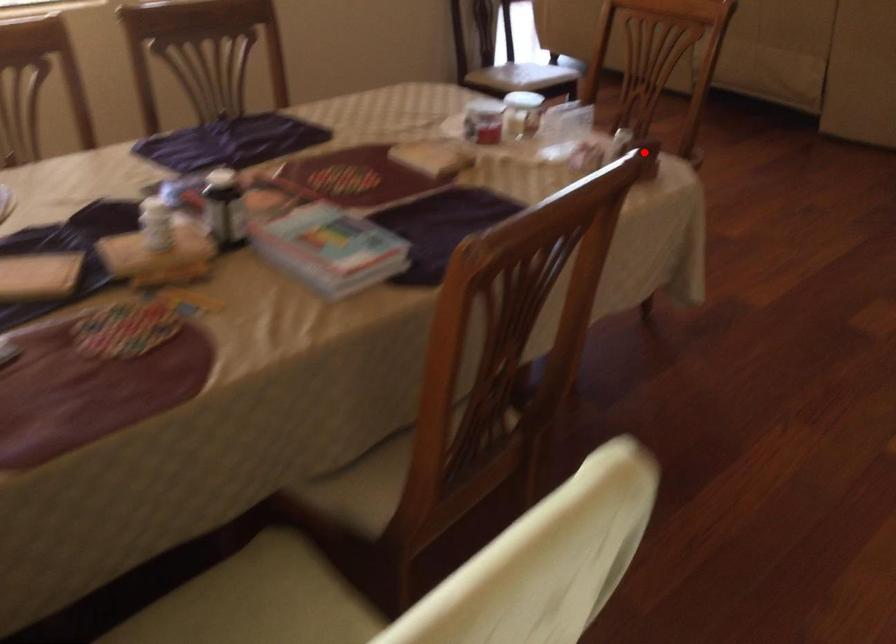
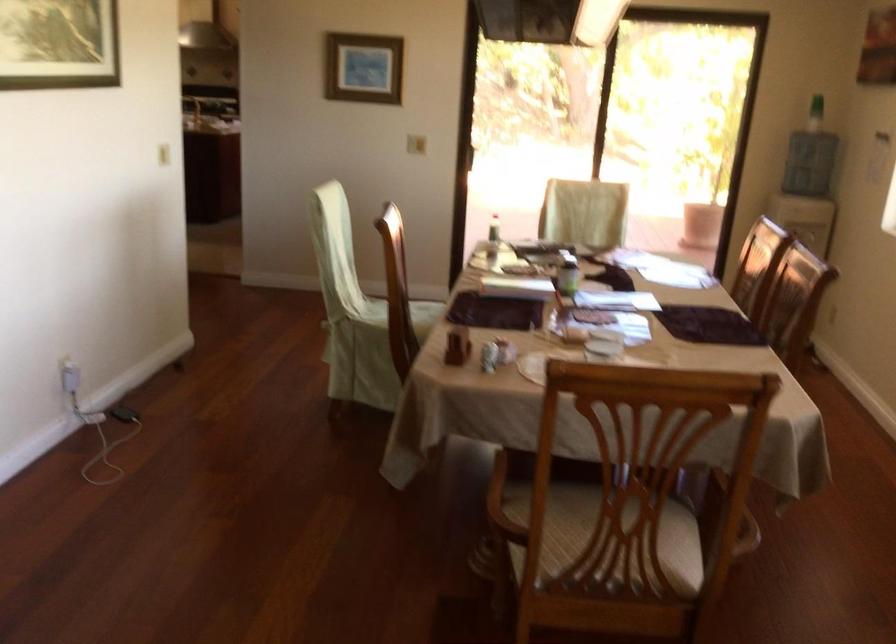
The point at the highlighted location is marked in the first image. Where is the corresponding point in the second image?

(458, 345)